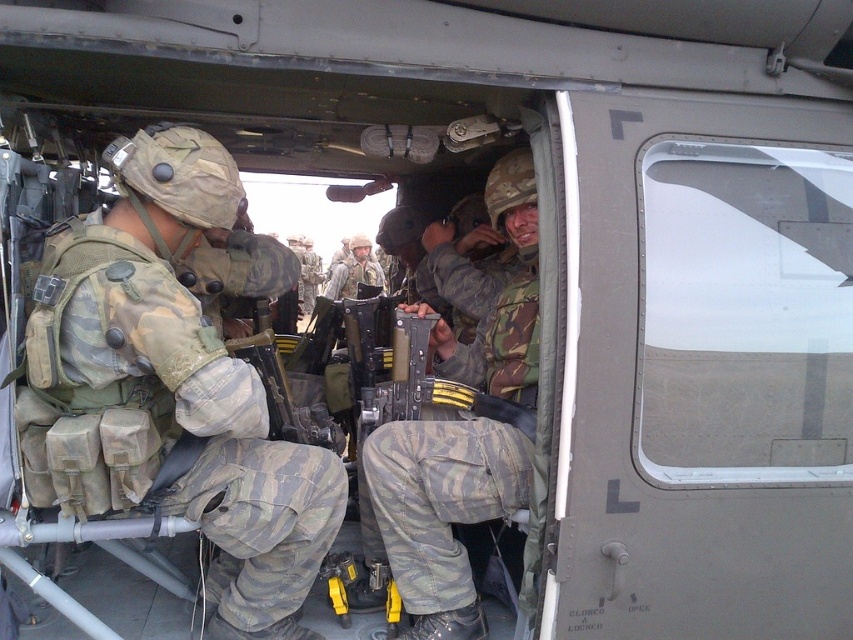
Question: Which point is farther from the camera taking this photo?

Choices:
 (A) (444, 499)
 (B) (352, 259)
 (C) (129, 243)

Answer: (B)

Question: Is camouflage fabric uniform at center below camouflage uniform at center?

Choices:
 (A) no
 (B) yes

Answer: (B)

Question: Which is farther from the camouflage uniform at center?

Choices:
 (A) camouflage fabric helmet at center
 (B) camouflage fabric uniform at center

Answer: (B)

Question: Does camouflage fabric helmet at center appear on the left side of camouflage uniform at center?

Choices:
 (A) no
 (B) yes

Answer: (A)

Question: Does camouflage fabric helmet at center come behind camouflage uniform at center?

Choices:
 (A) no
 (B) yes

Answer: (A)

Question: Which point appears closest to the camera in this image?

Choices:
 (A) (352, 273)
 (B) (32, 342)

Answer: (B)